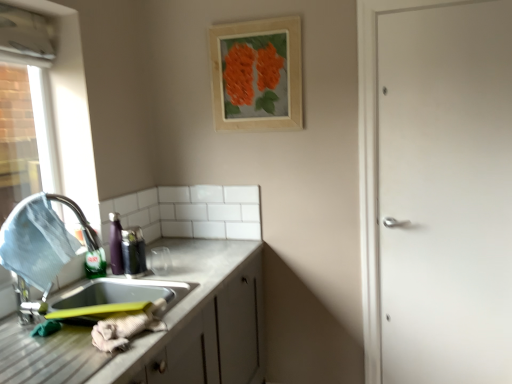
I want to click on vacant space in front of metallic stainless steel sink at left, so click(x=27, y=346).